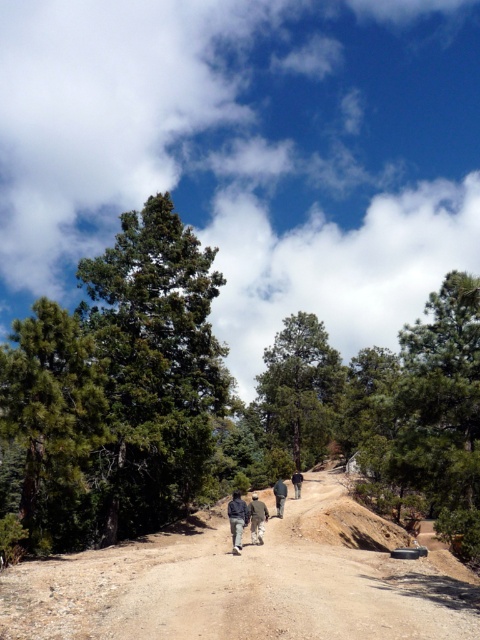
You are a hiker who wants to take a photo of the green textured tree at center and the light gray fabric pants at center from your current position. Can you fit both in the frame of your camera which has a maximum field of view of 30 feet?

The distance between the green textured tree at center and the light gray fabric pants at center is 34.13 feet, which exceeds the camera field of view of 30 feet. Therefore, you cannot fit both in the frame.

You are a photographer standing at the starting point of the dirt path in the forest scene. You want to capture a photo that includes both the point at coordinates point (420, 326) and point (298, 484). Which point should you focus on first to ensure both are in sharp focus?

You should focus on point (420, 326) first because it is closer to the camera than point (298, 484). By focusing on the closer point, the farther point will also be within the depth of field, ensuring both are in sharp focus.

You are standing at the starting point of the dirt path in the forest. You want to reach the green matte tree at right. Which direction should you walk along the path?

The green matte tree at right is located at point (425, 413), so you should walk along the dirt path towards the right direction to reach it.